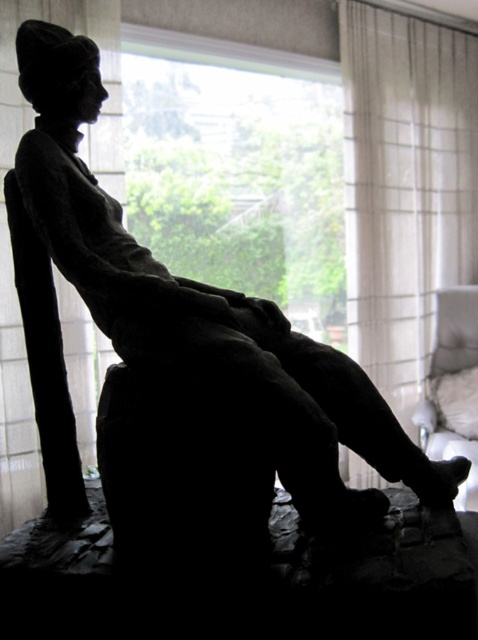
Does transparent glass window at upper center have a greater height compared to white sheer curtain at right?

No.

In the scene shown: Between transparent glass window at upper center and white sheer curtain at right, which one appears on the right side from the viewer's perspective?

From the viewer's perspective, white sheer curtain at right appears more on the right side.

Who is more distant from viewer, (265, 204) or (391, 401)?

Positioned behind is point (391, 401).

Where is `transparent glass window at upper center`? This screenshot has height=640, width=478. transparent glass window at upper center is located at coordinates 239,170.

Describe the element at coordinates (404, 188) in the screenshot. I see `white sheer curtain at right` at that location.

Is point (438, 180) positioned behind point (456, 506)?

Yes.

The image size is (478, 640). In order to click on white sheer curtain at right in this screenshot , I will do `click(404, 188)`.

Can you confirm if transparent glass window at upper center is shorter than white fabric armchair at right?

In fact, transparent glass window at upper center may be taller than white fabric armchair at right.

Is point (300, 250) positioned after point (469, 317)?

No, it is not.

This screenshot has height=640, width=478. What are the coordinates of `transparent glass window at upper center` in the screenshot? It's located at (239, 170).